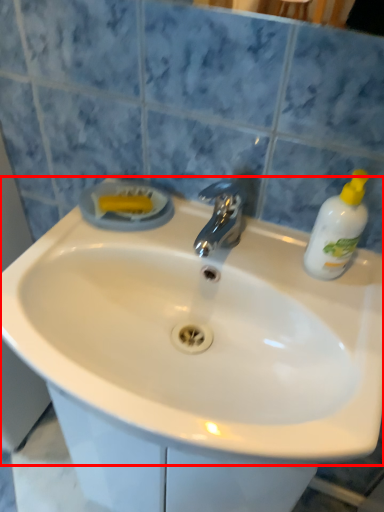
Question: From the image's perspective, what is the correct spatial positioning of sink (annotated by the red box) in reference to cleaning product?

Choices:
 (A) above
 (B) below

Answer: (B)